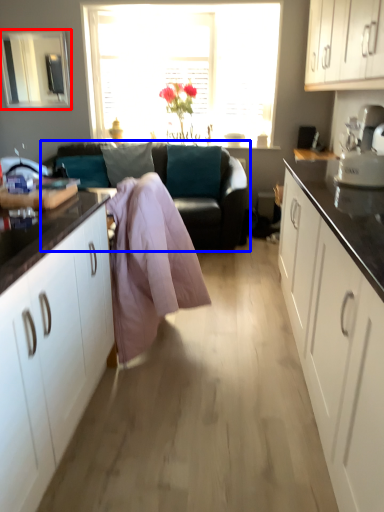
Question: Among these objects, which one is nearest to the camera, window screen (highlighted by a red box) or studio couch (highlighted by a blue box)?

Choices:
 (A) window screen
 (B) studio couch

Answer: (B)